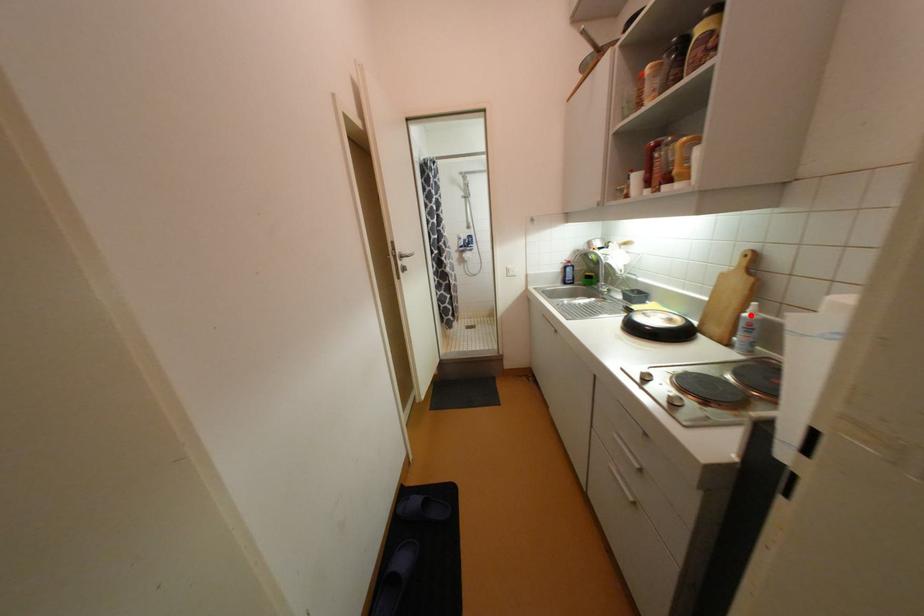
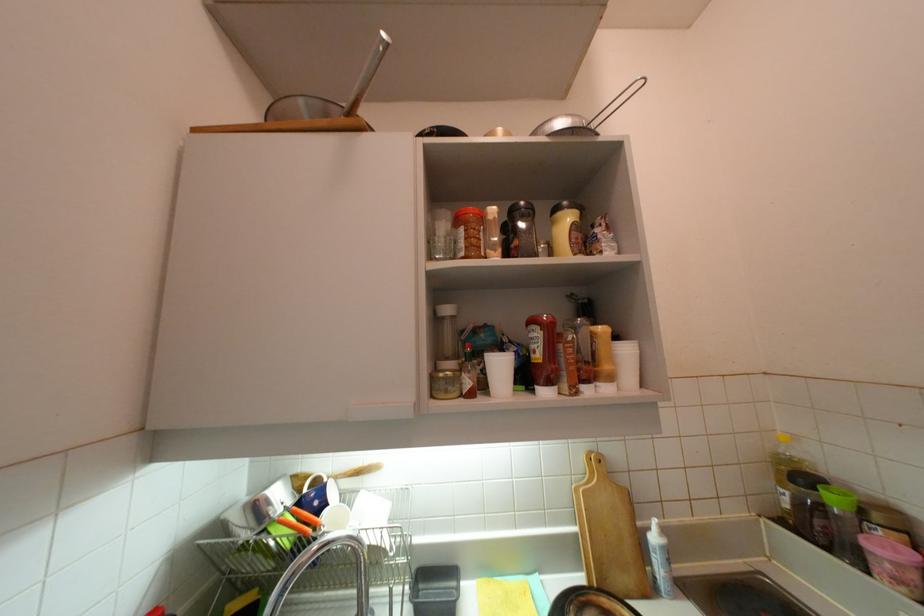
Question: I am providing you with two images of the same scene from different viewpoints. A red point is marked on the first image. Is the red point's position out of view in image 2?

Choices:
 (A) Yes
 (B) No

Answer: (B)